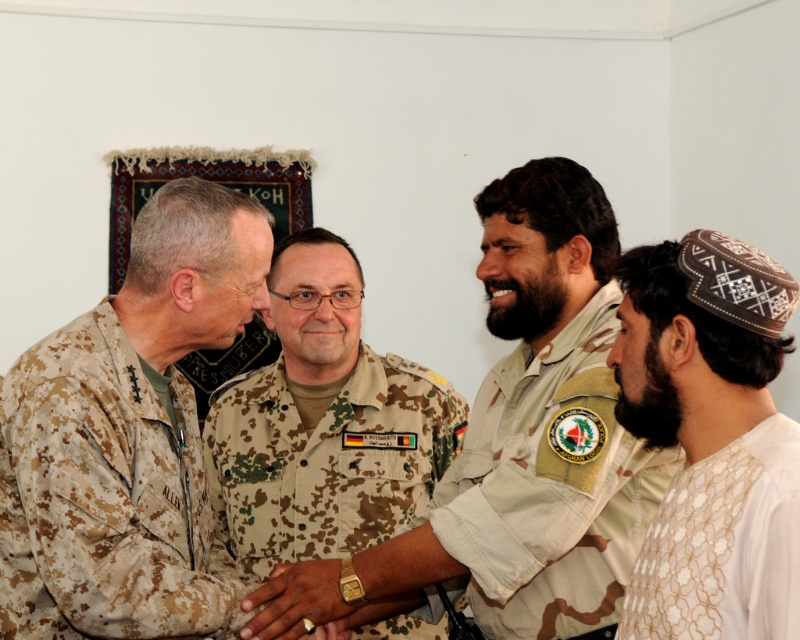
Who is taller, camouflage fabric uniform at center or white embroidered shirt at lower right?

camouflage fabric uniform at center is taller.

Which is behind, point (550, 608) or point (760, 504)?

Point (550, 608)

Find the location of a particular element. The image size is (800, 640). camouflage fabric uniform at center is located at coordinates (550, 486).

Who is more forward, (248,419) or (776,435)?

Point (776,435) is more forward.

Describe the element at coordinates (326, 460) in the screenshot. Image resolution: width=800 pixels, height=640 pixels. I see `camo fabric uniform at center` at that location.

Image resolution: width=800 pixels, height=640 pixels. What do you see at coordinates (326, 460) in the screenshot?
I see `camo fabric uniform at center` at bounding box center [326, 460].

Where is `camo fabric uniform at center`? Image resolution: width=800 pixels, height=640 pixels. camo fabric uniform at center is located at coordinates click(326, 460).

Measure the distance from camouflage uniform at center to white embroidered shirt at lower right.

A distance of 15.55 inches exists between camouflage uniform at center and white embroidered shirt at lower right.

Who is more distant from viewer, (532, 472) or (744, 477)?

Point (532, 472)

This screenshot has width=800, height=640. I want to click on camouflage uniform at center, so click(x=524, y=440).